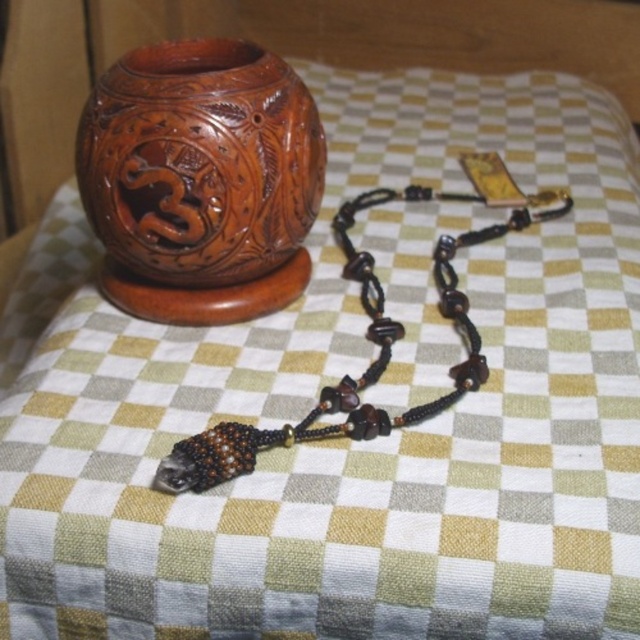
You are an interior designer arranging items on a checkered table. You have a carved wood vase at upper left and a brown beaded necklace at lower left. Which object is shorter in height?

The carved wood vase at upper left is shorter than the brown beaded necklace at lower left in height.

You are standing in front of the wooden object and beaded necklace on the checkered fabric. You want to know how far the point at coordinates point (x=136, y=118) is from you. Can you determine the distance?

The distance of point (x=136, y=118) from camera is 3.62 feet.

You are organizing a display and need to place the carved wood vase at upper left and the brown beaded necklace at lower left into a narrow shelf. The shelf is only wide enough for the thinner item. Which item should you choose?

The carved wood vase at upper left is thinner than the brown beaded necklace at lower left, so you should choose the carved wood vase at upper left for the narrow shelf.